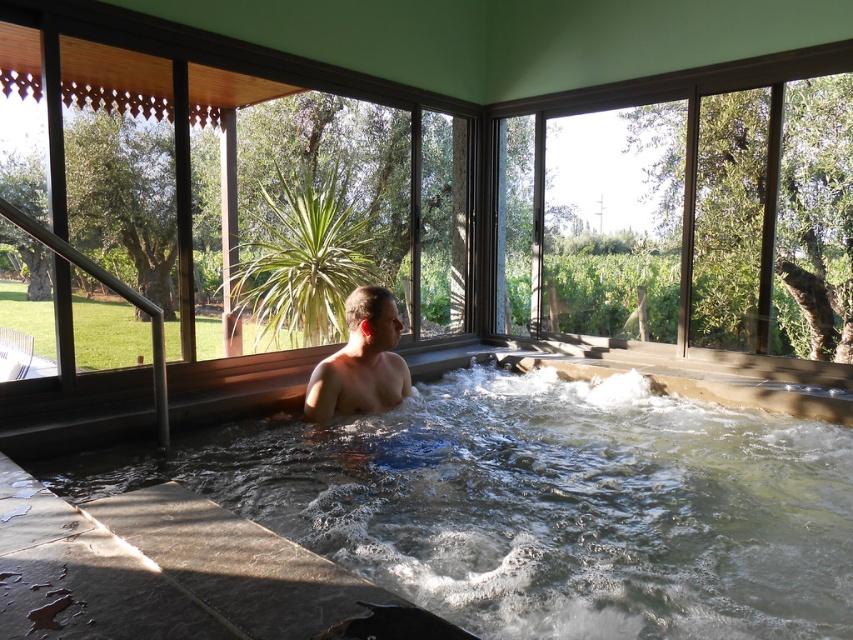
You are standing in the room with the clear acrylic hot tub at center and want to check if you can reach the edge of the hot tub without getting into it. The average person is about 5.8 feet tall. Can you safely do this?

The clear acrylic hot tub at center is 4.80 feet away from the viewer. Since the average person is 5.8 feet tall, you can safely reach the edge of the clear acrylic hot tub at center without entering it.

In the scene shown: You are designing a new spa and want to ensure the clear acrylic hot tub at center is visible from the entrance. Since the smooth skin man at center is using it, will the hot tub be visible over his body?

The clear acrylic hot tub at center is not as tall as smooth skin man at center, so the hot tub will not be visible over his body because it is shorter in height.